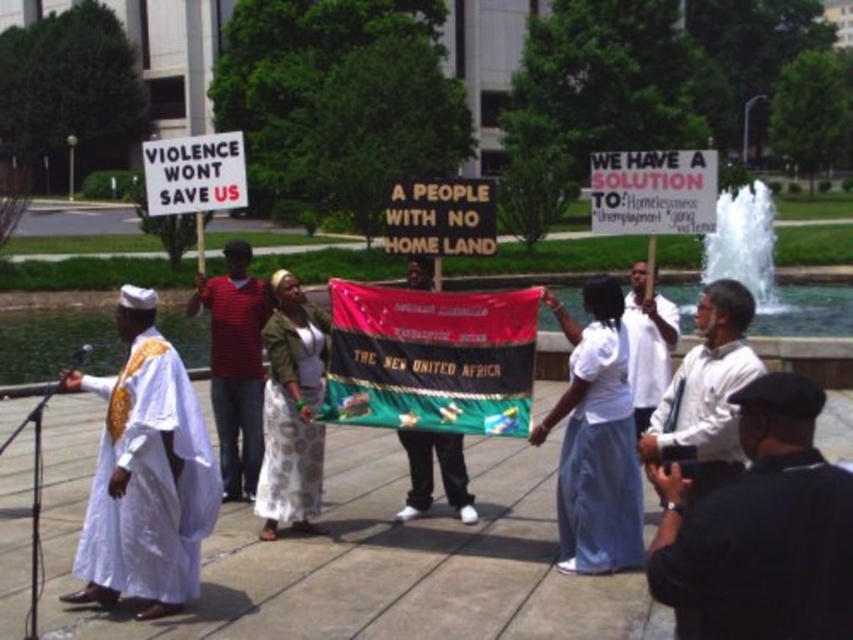
Is point (277, 460) positioned before point (245, 356)?

Yes, point (277, 460) is closer to viewer.

Can you confirm if white textured dress at center is positioned to the left of white satin robe at center?

In fact, white textured dress at center is to the right of white satin robe at center.

Is point (300, 390) positioned in front of point (260, 440)?

Yes, it is.

Locate an element on the screen. white textured dress at center is located at coordinates (292, 419).

Can you confirm if black fabric camera at lower right is smaller than white satin robe at center?

Yes.

Is point (764, 600) farther from camera compared to point (258, 461)?

No, it is not.

This screenshot has height=640, width=853. In order to click on black fabric camera at lower right in this screenshot , I will do `click(761, 529)`.

Does white shirt at center have a larger size compared to white satin robe at center?

Actually, white shirt at center might be smaller than white satin robe at center.

Between white shirt at center and white satin robe at center, which one is positioned higher?

white shirt at center

Is point (735, 316) behind point (231, 468)?

That is False.

Locate an element on the screen. This screenshot has height=640, width=853. white shirt at center is located at coordinates (706, 390).